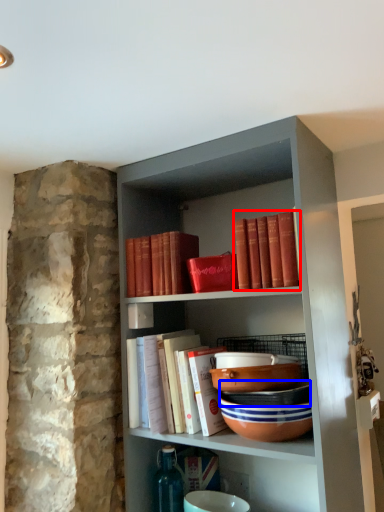
Question: Which object appears closest to the camera in this image, book (highlighted by a red box) or bowl (highlighted by a blue box)?

Choices:
 (A) book
 (B) bowl

Answer: (A)